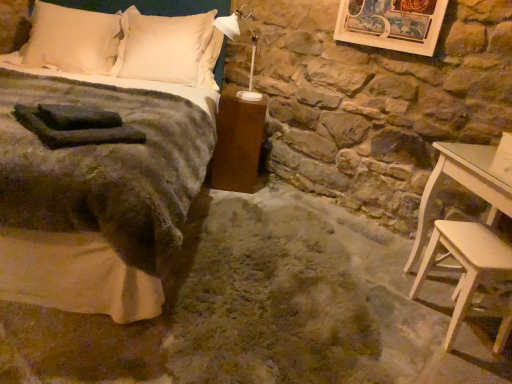
Find the location of `free space behind light beige wood stool at lower right`. free space behind light beige wood stool at lower right is located at coordinates (410, 286).